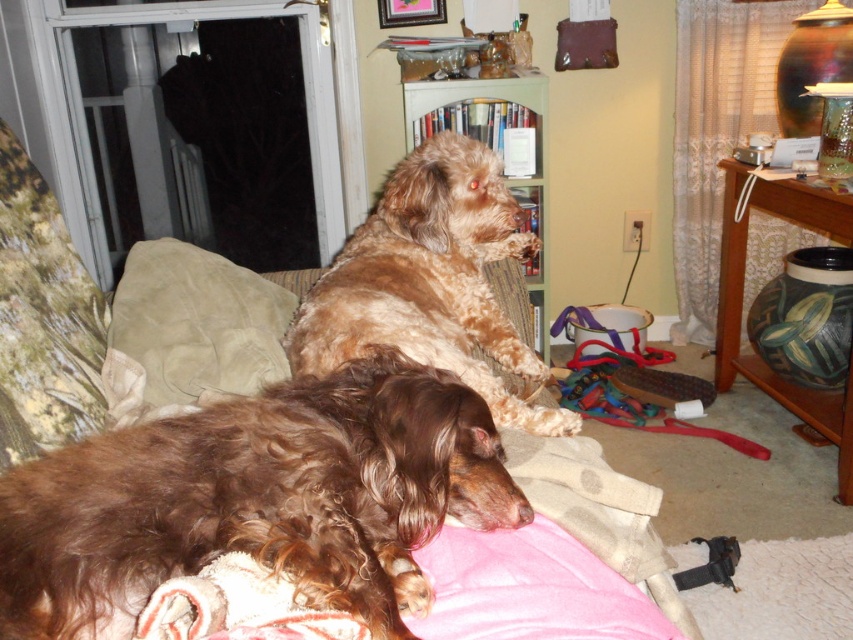
Question: Is brown shaggy dog at lower left above beige suede pillow at center?

Choices:
 (A) yes
 (B) no

Answer: (B)

Question: Which point appears closest to the camera in this image?

Choices:
 (A) (264, 624)
 (B) (22, 392)

Answer: (A)

Question: Which point is closer to the camera taking this photo?

Choices:
 (A) (258, 316)
 (B) (389, 449)
 (C) (685, 618)
 (D) (486, 189)

Answer: (B)

Question: Is brown furry dog at upper center behind pink soft blanket at lower center?

Choices:
 (A) no
 (B) yes

Answer: (B)

Question: Can you confirm if brown furry dog at upper center is positioned below beige suede pillow at center?

Choices:
 (A) no
 (B) yes

Answer: (A)

Question: Which of the following is the farthest from the observer?

Choices:
 (A) (140, 307)
 (B) (56, 436)

Answer: (A)